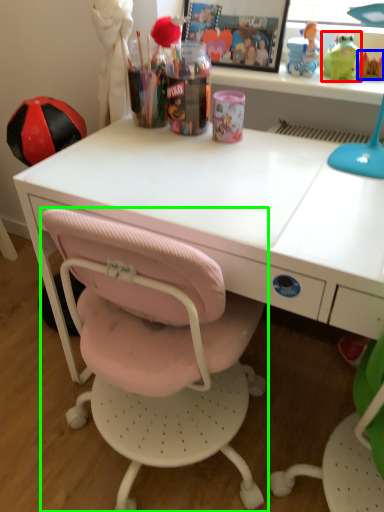
Question: Which is farther away from toy (highlighted by a red box)? toy (highlighted by a blue box) or chair (highlighted by a green box)?

Choices:
 (A) toy
 (B) chair

Answer: (B)